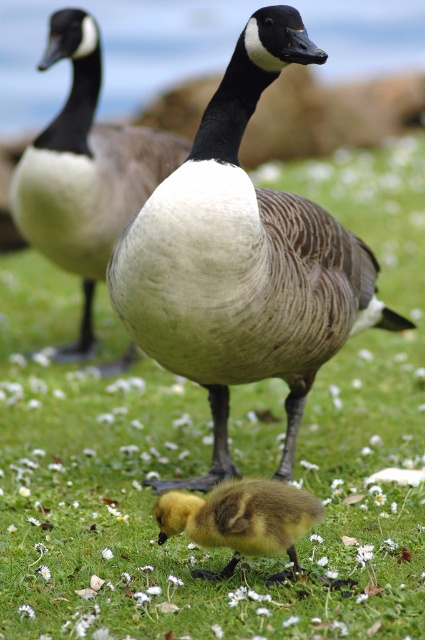
Question: Is brown feathered goose at center to the right of white downy goose at center from the viewer's perspective?

Choices:
 (A) no
 (B) yes

Answer: (B)

Question: From the image, what is the correct spatial relationship of white downy goose at center in relation to soft yellow duckling at center?

Choices:
 (A) left
 (B) right

Answer: (A)

Question: Among these objects, which one is farthest from the camera?

Choices:
 (A) white downy goose at center
 (B) brown feathered goose at center
 (C) soft yellow duckling at center

Answer: (A)

Question: Which point is farther to the camera?

Choices:
 (A) brown feathered goose at center
 (B) white downy goose at center
 (C) soft yellow duckling at center

Answer: (B)

Question: Is white downy goose at center smaller than soft yellow duckling at center?

Choices:
 (A) yes
 (B) no

Answer: (B)

Question: Which is nearer to the white downy goose at center?

Choices:
 (A) soft yellow duckling at center
 (B) brown feathered goose at center

Answer: (B)